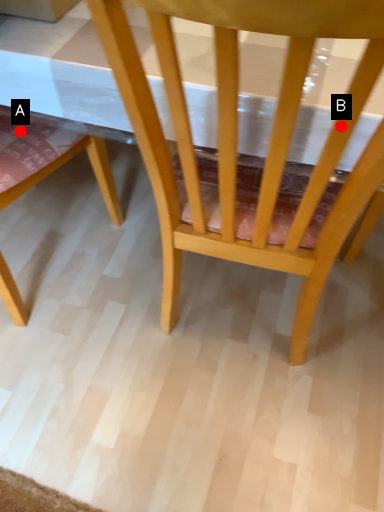
Question: Two points are circled on the image, labeled by A and B beside each circle. Which point appears farthest from the camera in this image?

Choices:
 (A) A is further
 (B) B is further

Answer: (A)